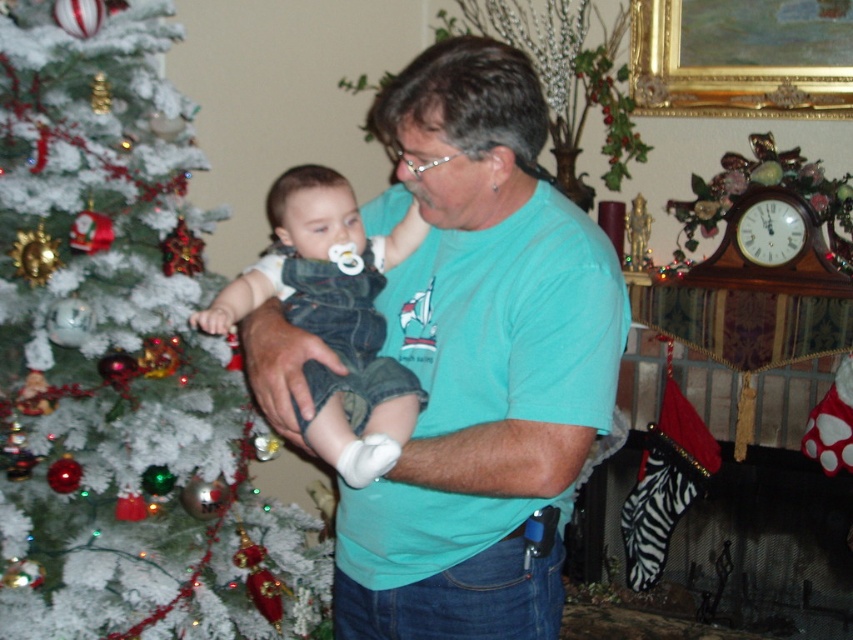
This screenshot has height=640, width=853. What do you see at coordinates (123, 362) in the screenshot?
I see `white frosted tree at left` at bounding box center [123, 362].

Which is in front, point (149, 61) or point (555, 209)?

Point (555, 209)

The height and width of the screenshot is (640, 853). In order to click on white frosted tree at left in this screenshot , I will do `click(123, 362)`.

Who is more forward, (413, 632) or (704, 99)?

Positioned in front is point (413, 632).

Which is more to the left, teal t-shirt at center or gold ornate picture frame at upper right?

teal t-shirt at center is more to the left.

At what (x,y) coordinates should I click in order to perform the action: click on teal t-shirt at center. Please return your answer as a coordinate pair (x, y). Looking at the image, I should click on (479, 362).

Can you confirm if white frosted tree at left is shorter than denim overalls at center?

In fact, white frosted tree at left may be taller than denim overalls at center.

Between white frosted tree at left and denim overalls at center, which one appears on the right side from the viewer's perspective?

Positioned to the right is denim overalls at center.

Identify the location of white frosted tree at left. (123, 362).